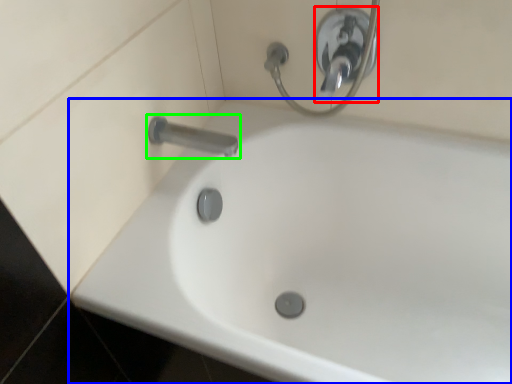
Question: Which is farther away from shower (highlighted by a red box)? bathtub (highlighted by a blue box) or tap (highlighted by a green box)?

Choices:
 (A) bathtub
 (B) tap

Answer: (A)